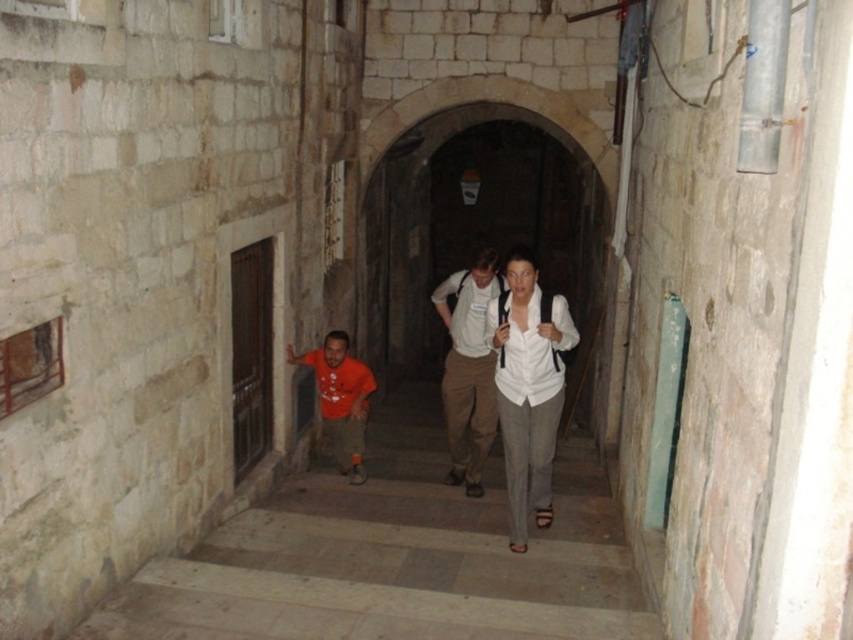
Is orange t-shirt at center bigger than stone archway at center?

Actually, orange t-shirt at center might be smaller than stone archway at center.

Is orange t-shirt at center shorter than stone archway at center?

Yes.

Locate an element on the screen. This screenshot has width=853, height=640. orange t-shirt at center is located at coordinates (395, 556).

This screenshot has height=640, width=853. In order to click on orange t-shirt at center in this screenshot , I will do `click(395, 556)`.

Is point (463, 372) farther from camera compared to point (318, 388)?

No, (463, 372) is in front of (318, 388).

Which is behind, point (483, 337) or point (369, 381)?

The point (369, 381) is more distant.

Does point (492, 284) lie in front of point (367, 390)?

Yes, it is.

The width and height of the screenshot is (853, 640). In order to click on white cotton shirt at center in this screenshot , I will do `click(468, 369)`.

Who is positioned more to the left, stone archway at center or matte orange t-shirt at lower center?

matte orange t-shirt at lower center

Does stone archway at center come behind matte orange t-shirt at lower center?

Yes.

Does point (515, 90) lie in front of point (357, 372)?

No, it is behind (357, 372).

Where is `stone archway at center`? This screenshot has height=640, width=853. stone archway at center is located at coordinates (490, 118).